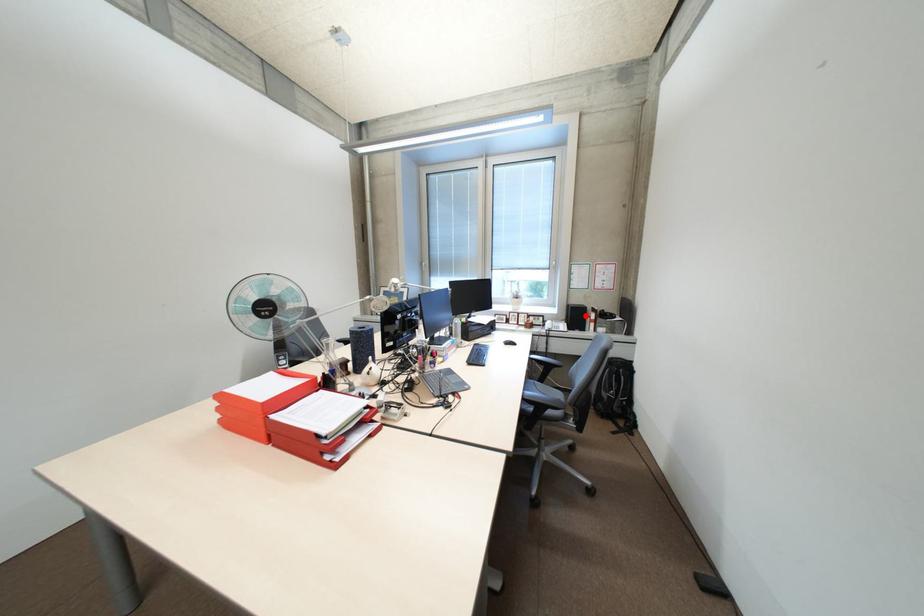
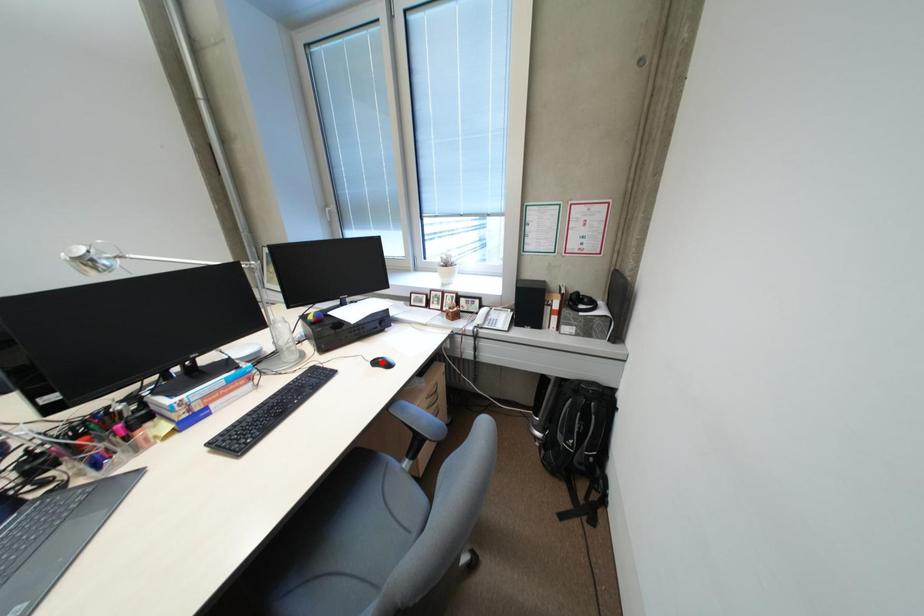
I am providing you with two images of the same scene from different viewpoints. A red point is marked on the first image and another point is marked on the second image. Do the highlighted points in image1 and image2 indicate the same real-world spot?

No